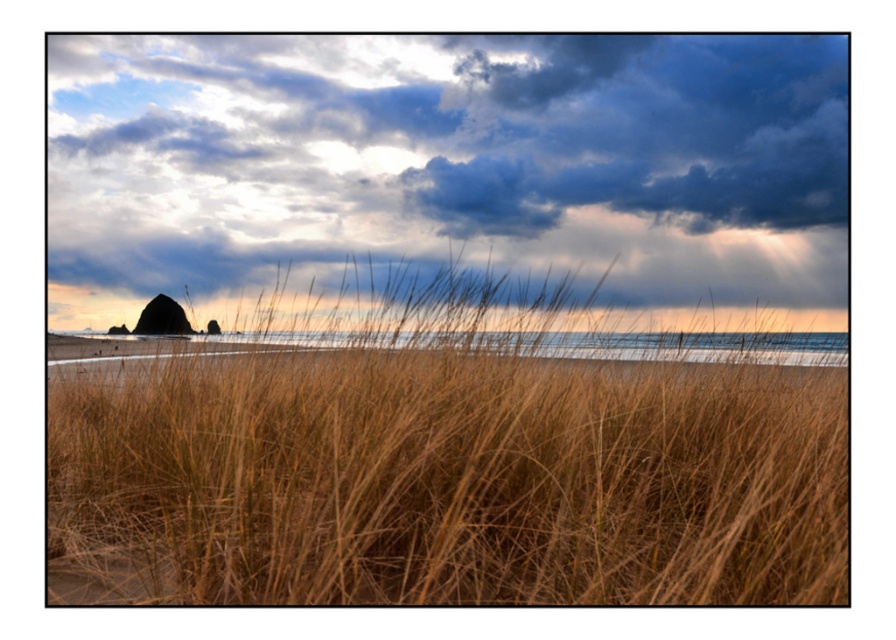
Which is in front, point (218, 538) or point (651, 160)?

Point (218, 538) is more forward.

Does brown dry grass at center have a greater width compared to dark blue textured cloud at upper center?

No.

Describe the element at coordinates (444, 451) in the screenshot. The image size is (896, 640). I see `brown dry grass at center` at that location.

Where is `brown dry grass at center`? brown dry grass at center is located at coordinates (444, 451).